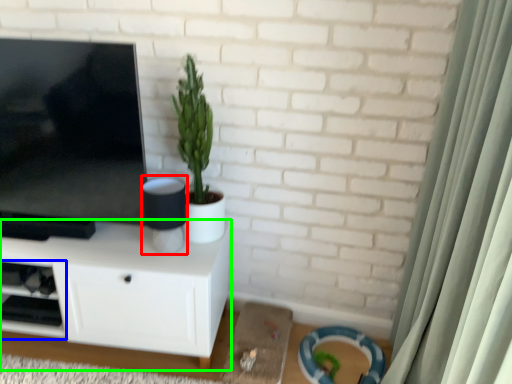
Question: Estimate the real-world distances between objects in this image. Which object is farther from speaker (highlighted by a red box), shelf (highlighted by a blue box) or cabinetry (highlighted by a green box)?

Choices:
 (A) shelf
 (B) cabinetry

Answer: (A)